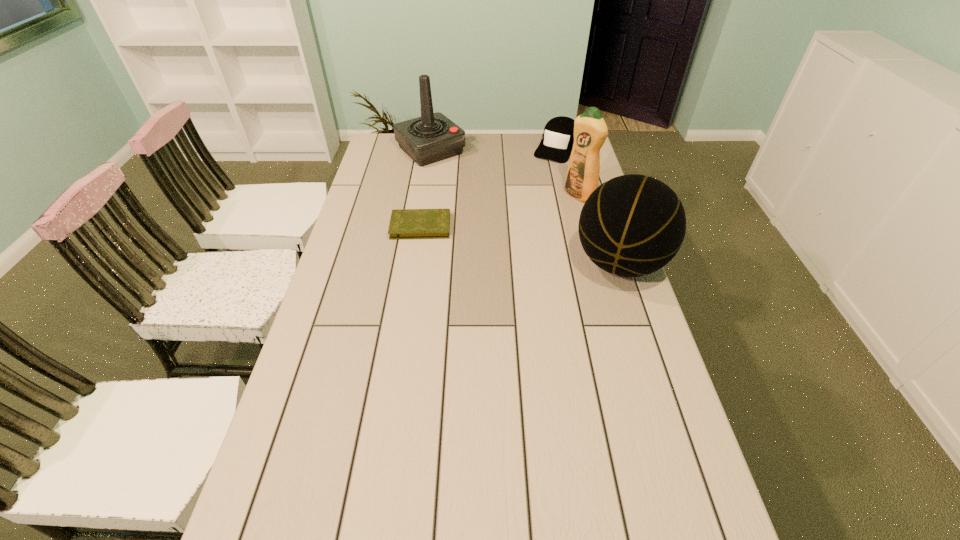
Locate an element on the screen. The width and height of the screenshot is (960, 540). vacant space on the desktop that is between the shortest object and the basketball and is positioned on the front-facing side of the fourth tallest object is located at coordinates (492, 240).

Where is `vacant spot on the desktop that is between the shortest object and the basketball and is positioned on the label of the third nearest object`? The image size is (960, 540). vacant spot on the desktop that is between the shortest object and the basketball and is positioned on the label of the third nearest object is located at coordinates (508, 242).

Identify the location of free spot on the desktop that is between the shortest object and the basketball and is positioned on the front-facing side of the joystick. (540, 248).